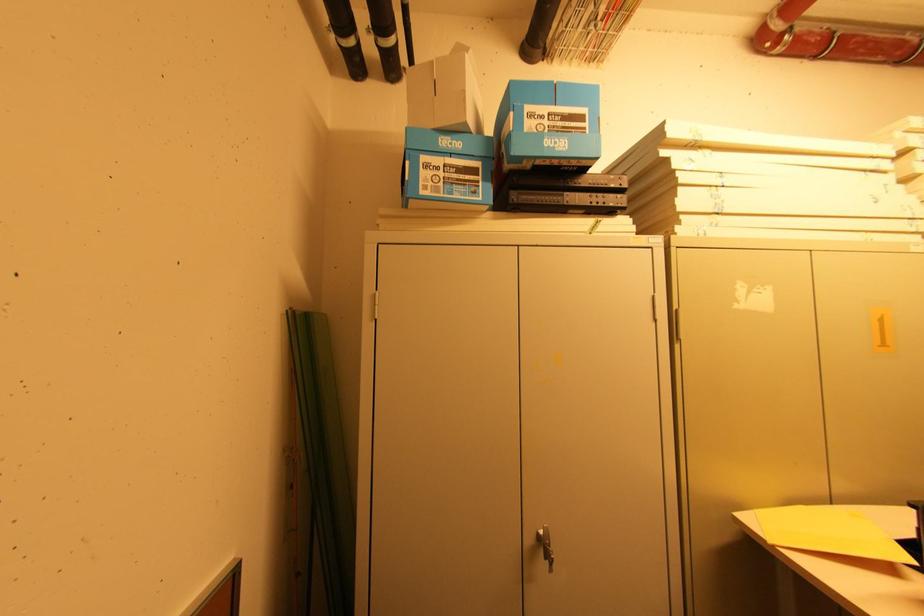
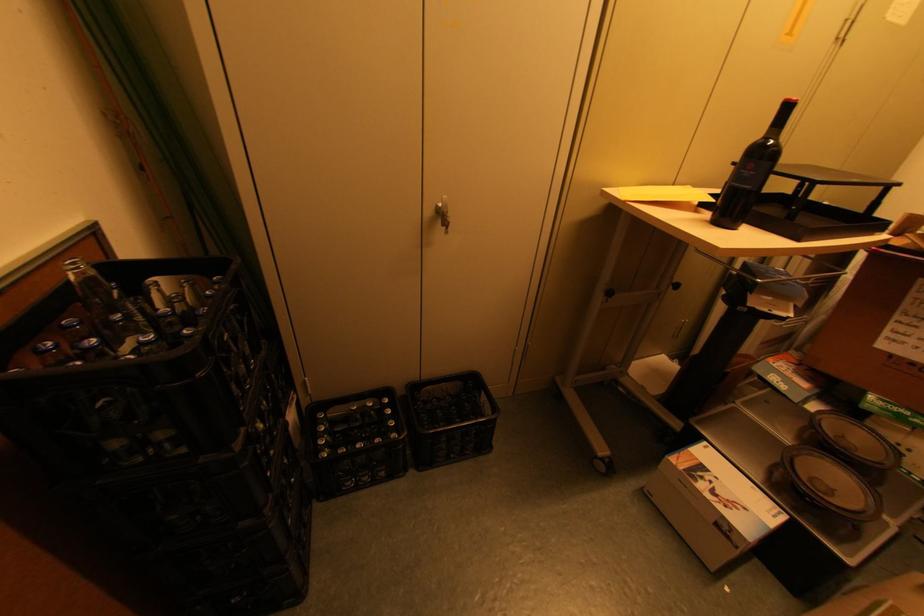
The images are taken continuously from a first-person perspective. In which direction is your viewpoint rotating?

The camera rotated toward right-down.